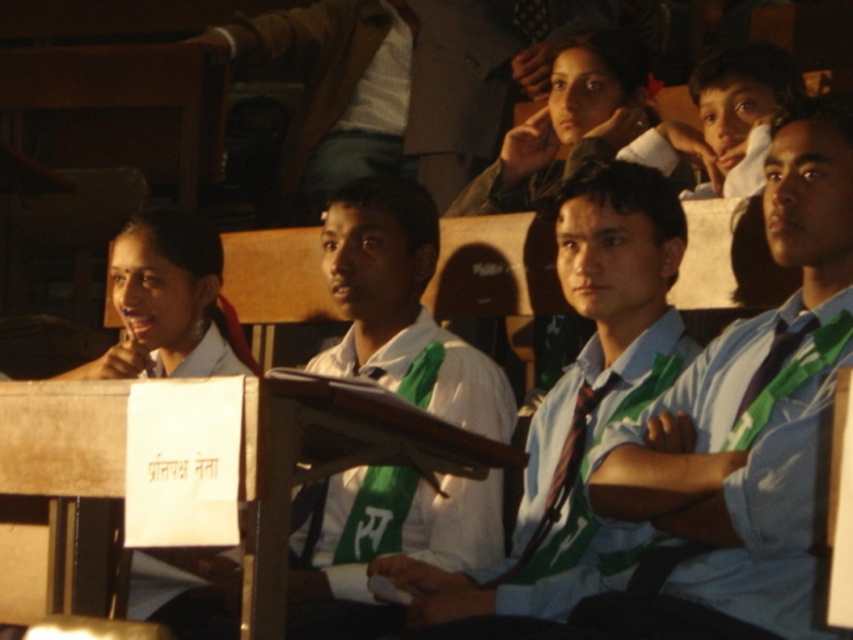
You are an attendee at this event and want to approach the podium. There are two people in your path. The first is the white shirt with green tie at center, and the second is the brown textured coat at upper center. Which person is closer to the podium?

The brown textured coat at upper center is closer to the podium because it is positioned at upper center, which is closer to the podium than the white shirt with green tie at center.

You are a photographer taking a group photo of the attendees in the auditorium. You notice two individuals wearing a light blue shirt at center and a white shirt with green tie at center. Which one should you focus on to ensure their entire torso is captured clearly in the photo?

The light blue shirt at center is larger in size than the white shirt with green tie at center, so focusing on the light blue shirt at center will ensure the entire torso is captured clearly.

You are standing in the auditorium and want to determine which of the two points, point (694, 518) or point (556, 216), is nearer to you. Based on the scene description, which point is closer?

Point (694, 518) is closer to the camera than point (556, 216), so it is the nearer one.